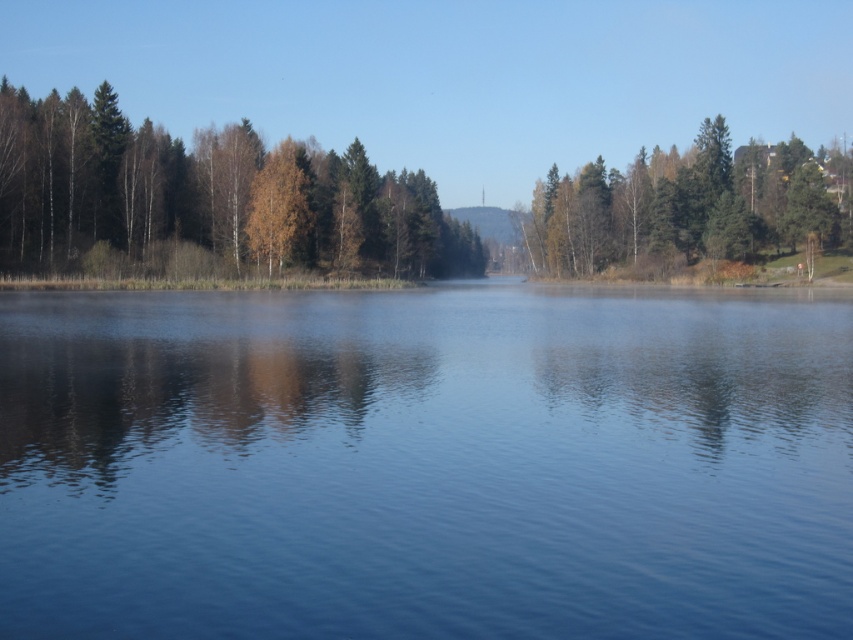
Does brown textured trees at left lie in front of green matte tree at upper right?

That is True.

Image resolution: width=853 pixels, height=640 pixels. Describe the element at coordinates (207, 195) in the screenshot. I see `brown textured trees at left` at that location.

Find the location of a particular element. This screenshot has height=640, width=853. brown textured trees at left is located at coordinates (207, 195).

From the picture: Is transparent water at center wider than green matte tree at upper right?

No, transparent water at center is not wider than green matte tree at upper right.

Is point (643, 570) positioned after point (665, 164)?

No, it is in front of (665, 164).

I want to click on transparent water at center, so click(425, 465).

Locate an element on the screen. transparent water at center is located at coordinates (425, 465).

Does transparent water at center lie in front of brown textured trees at left?

Yes, transparent water at center is in front of brown textured trees at left.

Identify the location of transparent water at center. The height and width of the screenshot is (640, 853). (425, 465).